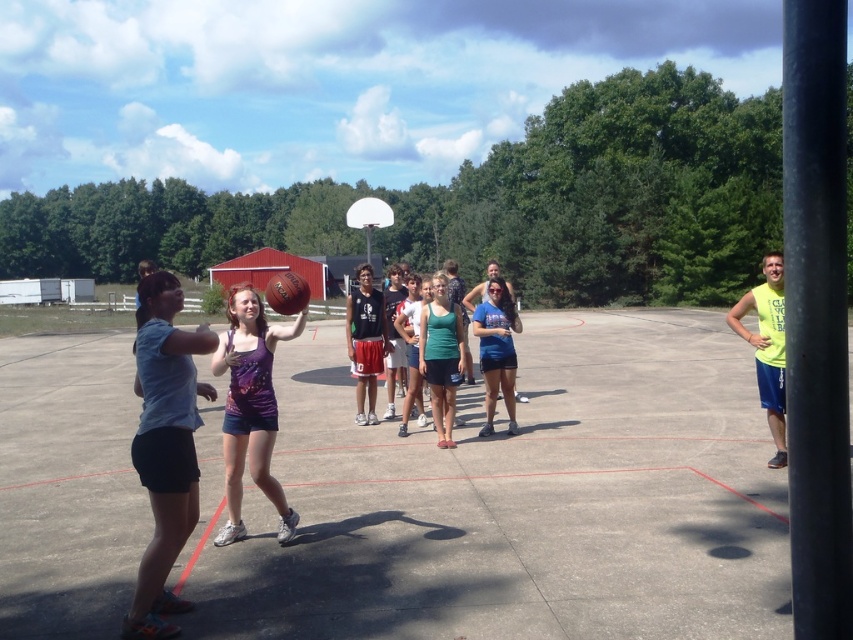
Is matte green tank top at center wider than rubber textured basketball at center?

In fact, matte green tank top at center might be narrower than rubber textured basketball at center.

Is point (461, 374) positioned behind point (279, 298)?

Yes, point (461, 374) is behind point (279, 298).

The image size is (853, 640). I want to click on matte green tank top at center, so click(x=440, y=356).

Between rubberized concrete basketball court at center and white glossy basketball hoop at center, which one appears on the right side from the viewer's perspective?

rubberized concrete basketball court at center

Can you confirm if rubberized concrete basketball court at center is positioned to the right of white glossy basketball hoop at center?

Correct, you'll find rubberized concrete basketball court at center to the right of white glossy basketball hoop at center.

Is point (200, 435) less distant than point (387, 211)?

That is True.

Locate an element on the screen. This screenshot has width=853, height=640. rubberized concrete basketball court at center is located at coordinates (514, 500).

Can you confirm if blue denim shorts at center is taller than white glossy basketball hoop at center?

No.

Which of these two, blue denim shorts at center or white glossy basketball hoop at center, stands shorter?

Standing shorter between the two is blue denim shorts at center.

Where is `blue denim shorts at center`? blue denim shorts at center is located at coordinates click(497, 349).